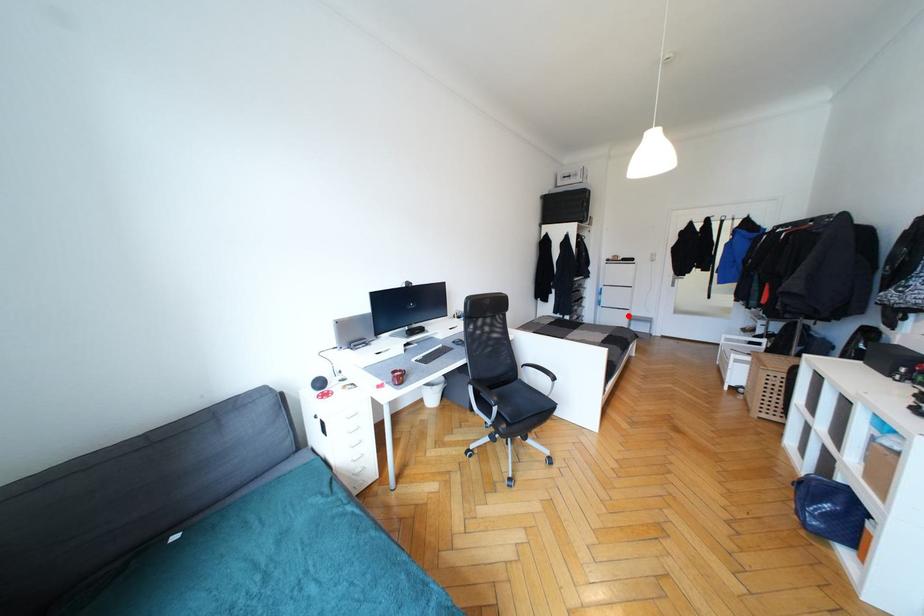
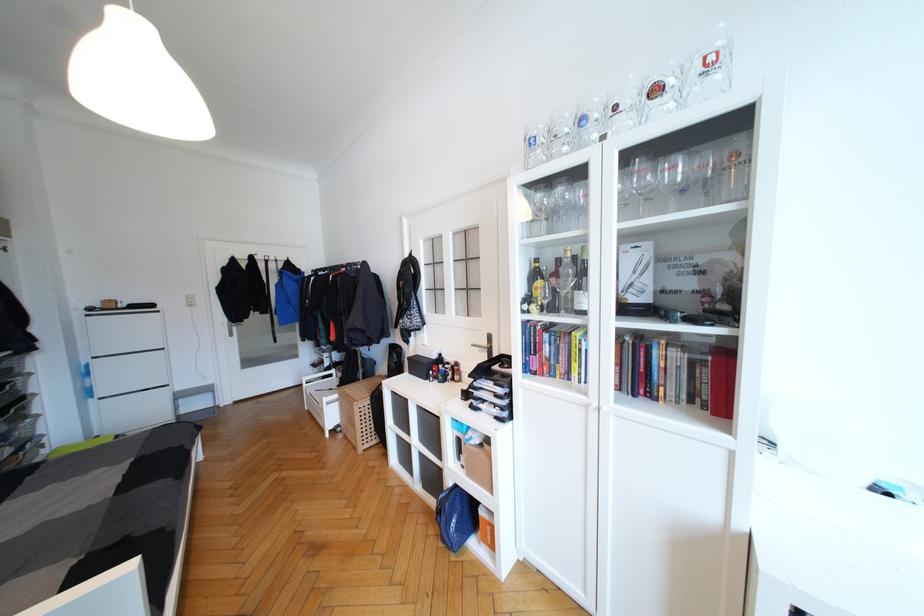
Find the pixel in the second image that matches the highlighted location in the first image.

(166, 397)